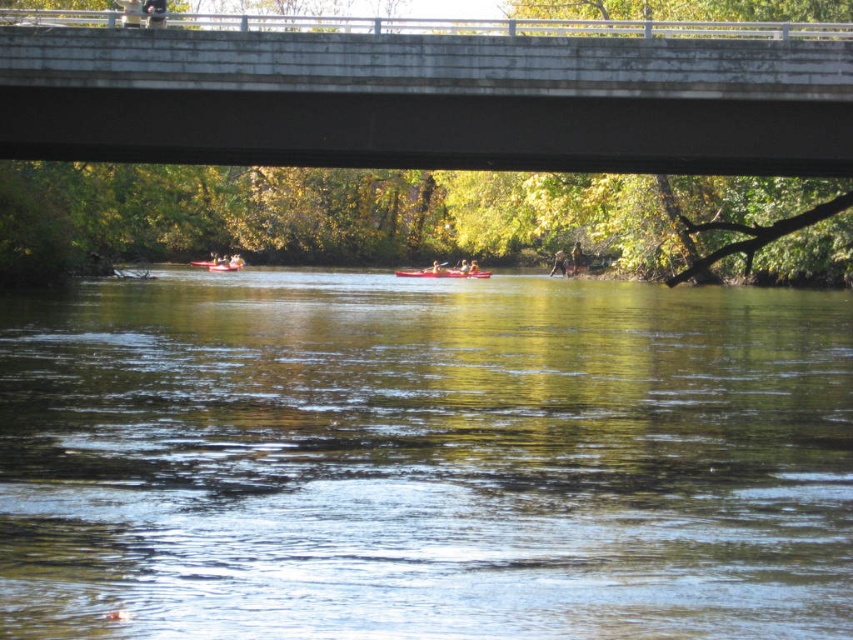
You are standing on the riverside and see the point marked at coordinates (218, 264). What object is located at that point?

The point at coordinates (218, 264) marks the location of the matte red kayak at center.

You are standing on the riverside and see the concrete bridge at upper center and the brown leather jacket at center. Which object is positioned to the left when viewed from your perspective?

The concrete bridge at upper center is to the left of the brown leather jacket at center.